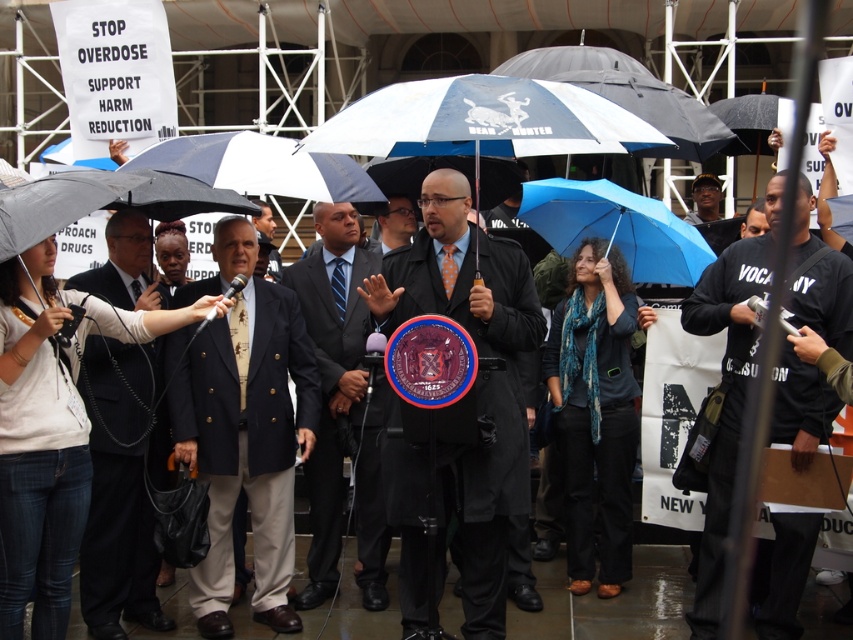
Between black cotton shirt at center and dark blue suit at center, which one appears on the right side from the viewer's perspective?

Positioned to the right is dark blue suit at center.

Where is `black cotton shirt at center`? black cotton shirt at center is located at coordinates (728, 390).

Is point (799, 561) farther from camera compared to point (165, 291)?

No, (799, 561) is closer to viewer.

Does black cotton shirt at center appear on the right side of dark suit at left?

Yes, black cotton shirt at center is to the right of dark suit at left.

Identify the location of black cotton shirt at center. This screenshot has height=640, width=853. click(728, 390).

The height and width of the screenshot is (640, 853). Find the location of `black cotton shirt at center`. black cotton shirt at center is located at coordinates (728, 390).

The height and width of the screenshot is (640, 853). Describe the element at coordinates (331, 376) in the screenshot. I see `black suit at center` at that location.

The height and width of the screenshot is (640, 853). Identify the location of black suit at center. (331, 376).